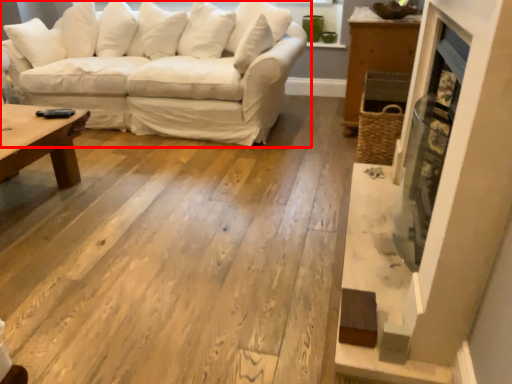
Question: From the image's perspective, what is the correct spatial relationship of studio couch (annotated by the red box) in relation to fireplace?

Choices:
 (A) above
 (B) below

Answer: (A)